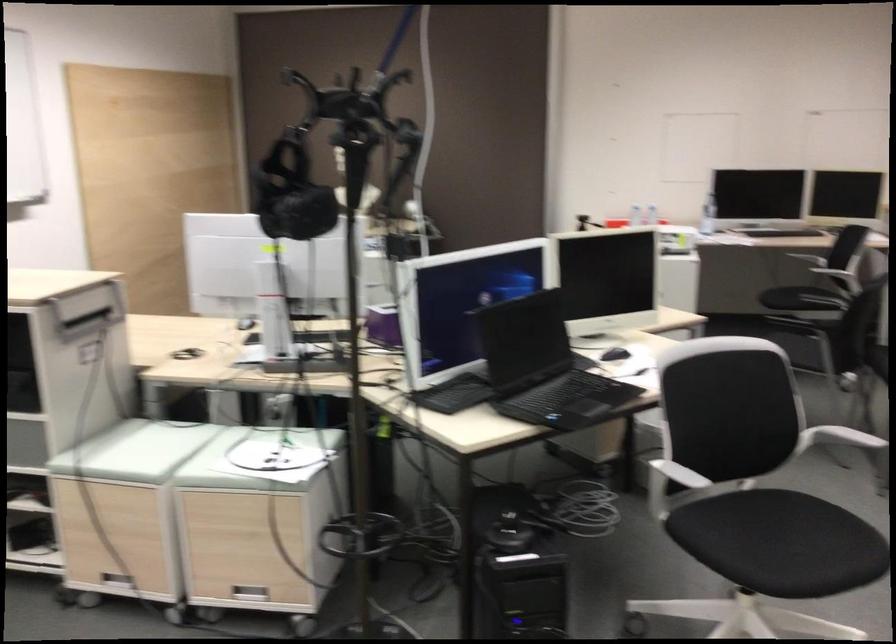
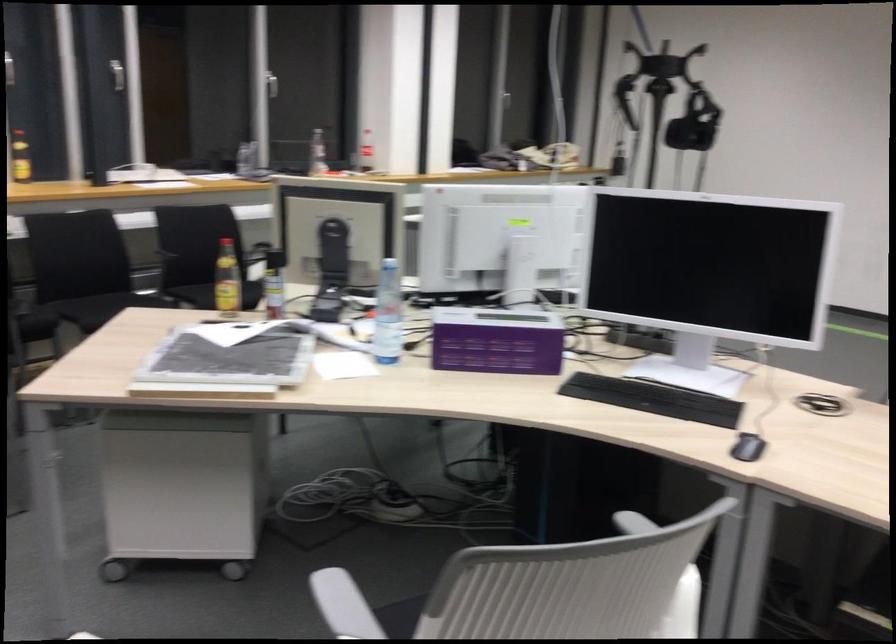
Question: I am providing you with two images of the same scene from different viewpoints. Which of the following objects are not visible in image2?

Choices:
 (A) grey pillar candle
 (B) metal drawer handle
 (C) white chair armrest
 (D) silver window handle

Answer: (B)